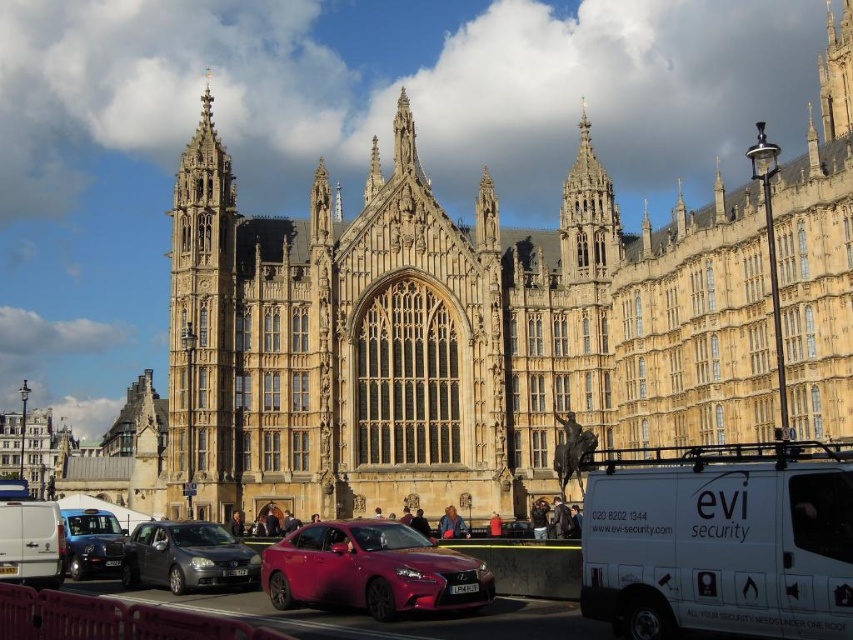
You are a photographer planning to capture the golden stone tower at left and the white matte van at lower right in the same frame. Given their relative sizes, which object will appear smaller in your photo?

The white matte van at lower right will appear smaller in the photo because it is thinner than the golden stone tower at left.

You are a tourist standing on the street in front of the historic building. You see the golden stone palace at center and the golden stone tower at left. Which structure is closer to your left side?

The golden stone tower at left is closer to your left side because it is positioned on the left side of the golden stone palace at center.

You are an architect planning to build a replica of the golden stone palace at center and golden stone tower at left. If you want to ensure the replica maintains the same proportional relationship between their widths as the original, which structure should you make wider in your design?

The golden stone palace at center should be made wider than the golden stone tower at left in the replica to maintain the original proportional relationship between their widths.